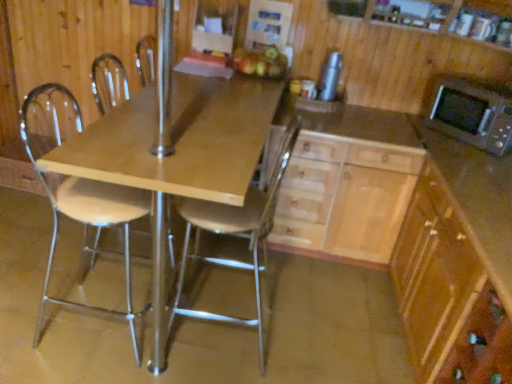
Question: In which direction should I rotate to look at light wood/wooden cabinet at center, the first cabinetry viewed from the left?

Choices:
 (A) right
 (B) left

Answer: (A)

Question: Is matte wood table at center bigger than silver metallic thermos at upper right?

Choices:
 (A) no
 (B) yes

Answer: (B)

Question: From the image's perspective, would you say matte wood table at center is positioned over silver metallic thermos at upper right?

Choices:
 (A) yes
 (B) no

Answer: (B)

Question: Can you confirm if matte wood table at center is wider than silver metallic thermos at upper right?

Choices:
 (A) yes
 (B) no

Answer: (A)

Question: From the image's perspective, is matte wood table at center below silver metallic thermos at upper right?

Choices:
 (A) no
 (B) yes

Answer: (B)

Question: Is matte wood table at center smaller than silver metallic thermos at upper right?

Choices:
 (A) yes
 (B) no

Answer: (B)

Question: Is matte wood table at center not within silver metallic thermos at upper right?

Choices:
 (A) no
 (B) yes

Answer: (B)

Question: Are light brown wood cabinet at lower right, which is the second cabinetry from left to right, and light wood/wooden cabinet at center, acting as the second cabinetry starting from the right, located far from each other?

Choices:
 (A) no
 (B) yes

Answer: (A)

Question: Does light brown wood cabinet at lower right, acting as the 1th cabinetry starting from the right, have a lesser width compared to light wood/wooden cabinet at center, acting as the second cabinetry starting from the right?

Choices:
 (A) no
 (B) yes

Answer: (A)

Question: From the image's perspective, would you say light brown wood cabinet at lower right, which is the second cabinetry from left to right, is positioned over light wood/wooden cabinet at center, the first cabinetry viewed from the left?

Choices:
 (A) yes
 (B) no

Answer: (B)

Question: Does light brown wood cabinet at lower right, which is the second cabinetry from left to right, lie in front of light wood/wooden cabinet at center, acting as the second cabinetry starting from the right?

Choices:
 (A) yes
 (B) no

Answer: (A)

Question: From a real-world perspective, is light brown wood cabinet at lower right, acting as the 1th cabinetry starting from the right, on light wood/wooden cabinet at center, the first cabinetry viewed from the left?

Choices:
 (A) no
 (B) yes

Answer: (B)

Question: Is light brown wood cabinet at lower right, which is the second cabinetry from left to right, completely or partially outside of light wood/wooden cabinet at center, the first cabinetry viewed from the left?

Choices:
 (A) no
 (B) yes

Answer: (B)

Question: Is matte wood table at center at the back of white plastic chair at left, arranged as the first chair when viewed from the left?

Choices:
 (A) no
 (B) yes

Answer: (B)